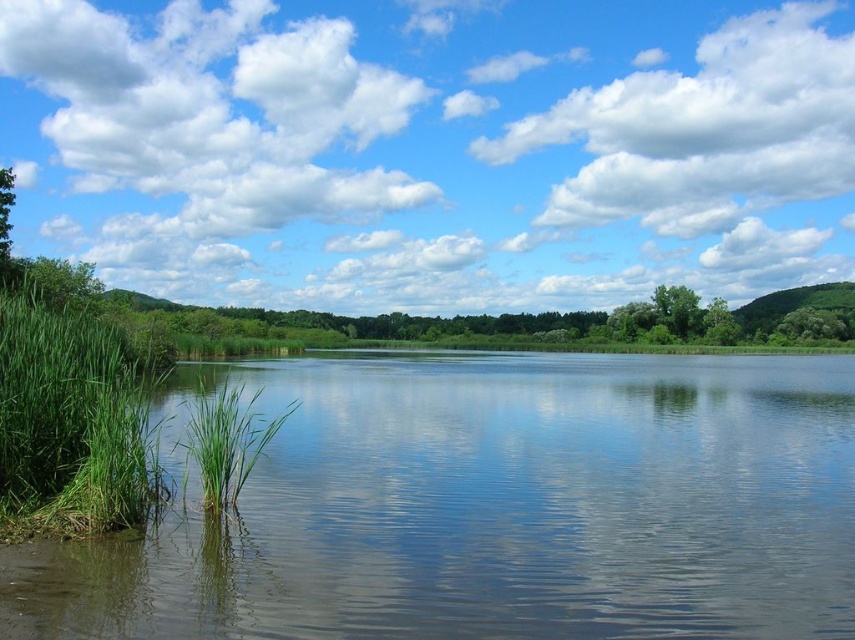
You are standing on the dock and see the green leafy grass at left and the green leafy tree at center. Which one is closer to your left side?

The green leafy grass at left is closer to your left side because it is positioned to the left of the green leafy tree at center.

You are a bird flying over the serene natural landscape. You notice the green leafy grass at left and the green leafy tree at center. Which one would you prefer to land on for a better view of the surrounding area?

The green leafy tree at center is taller than the green leafy grass at left, so landing on the green leafy tree at center would provide a better view of the surrounding area.

You are standing at the edge of the water and see the green matte grass at lower left and the green leafy tree at center. Which object is closer to your feet?

The green matte grass at lower left is closer to your feet because it is located below the green leafy tree at center, meaning it is positioned in front of the tree and nearer to the observer.